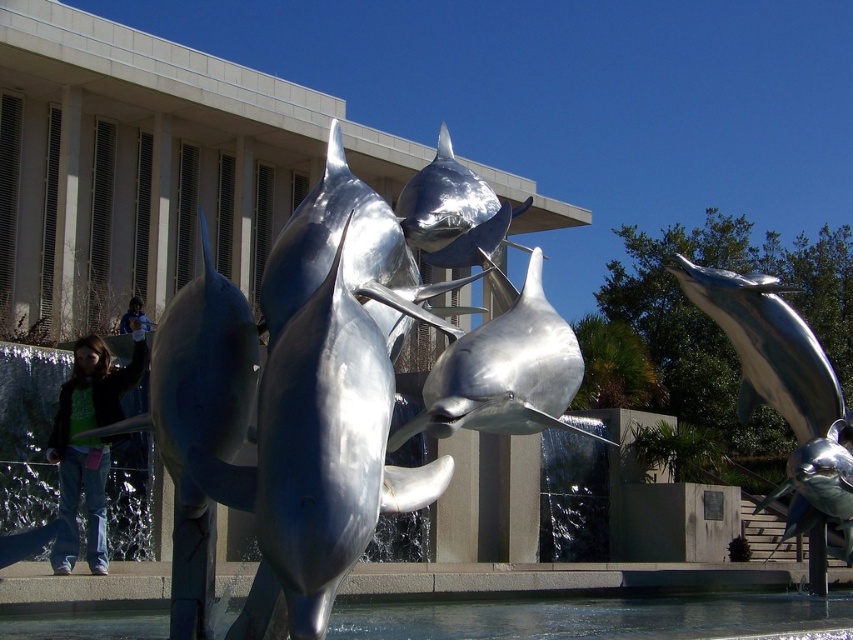
Question: Can you confirm if shiny metallic dolphin at center is positioned above shiny silver dolphin at right?

Choices:
 (A) no
 (B) yes

Answer: (A)

Question: Which of the following is the farthest from the observer?

Choices:
 (A) (554, 369)
 (B) (247, 324)

Answer: (A)

Question: Can you confirm if clear water at lower center is bigger than shiny silver dolphin at center?

Choices:
 (A) yes
 (B) no

Answer: (A)

Question: Which point appears closest to the camera in this image?

Choices:
 (A) (489, 634)
 (B) (546, 312)

Answer: (B)

Question: Among these objects, which one is farthest from the camera?

Choices:
 (A) shiny metallic dolphin at center
 (B) shiny silver dolphin at left
 (C) clear water at lower center

Answer: (C)

Question: Does shiny silver dolphin at left appear under shiny silver dolphin at right?

Choices:
 (A) yes
 (B) no

Answer: (A)